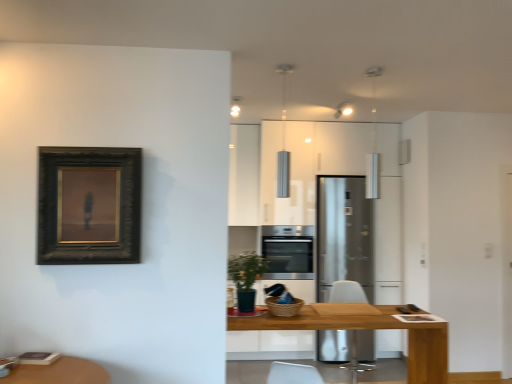
Question: Does satin silver refrigerator at center turn towards white plastic swivel chair at center?

Choices:
 (A) yes
 (B) no

Answer: (A)

Question: Does satin silver refrigerator at center have a greater height compared to white plastic swivel chair at center?

Choices:
 (A) no
 (B) yes

Answer: (B)

Question: Can you confirm if satin silver refrigerator at center is smaller than white plastic swivel chair at center?

Choices:
 (A) no
 (B) yes

Answer: (A)

Question: Is satin silver refrigerator at center not within white plastic swivel chair at center?

Choices:
 (A) no
 (B) yes

Answer: (B)

Question: Is the position of satin silver refrigerator at center less distant than that of white plastic swivel chair at center?

Choices:
 (A) yes
 (B) no

Answer: (B)

Question: Considering their positions, is white plastic swivel chair at center located in front of or behind wooden table at center?

Choices:
 (A) front
 (B) behind

Answer: (B)

Question: In the image, is white plastic swivel chair at center on the left side or the right side of wooden table at center?

Choices:
 (A) right
 (B) left

Answer: (A)

Question: From the image's perspective, is white plastic swivel chair at center located above or below wooden table at center?

Choices:
 (A) above
 (B) below

Answer: (B)

Question: Is white plastic swivel chair at center spatially inside wooden table at center, or outside of it?

Choices:
 (A) outside
 (B) inside

Answer: (A)

Question: Relative to dark wood frame at upper left, is satin silver refrigerator at center in front or behind?

Choices:
 (A) behind
 (B) front

Answer: (A)

Question: From a real-world perspective, is satin silver refrigerator at center positioned above or below dark wood frame at upper left?

Choices:
 (A) below
 (B) above

Answer: (A)

Question: Considering the positions of point (322, 246) and point (87, 203), is point (322, 246) closer or farther from the camera than point (87, 203)?

Choices:
 (A) farther
 (B) closer

Answer: (A)

Question: Is satin silver refrigerator at center situated inside dark wood frame at upper left or outside?

Choices:
 (A) inside
 (B) outside

Answer: (B)

Question: From the image's perspective, relative to wooden table at center, is dark wood frame at upper left above or below?

Choices:
 (A) above
 (B) below

Answer: (A)

Question: From a real-world perspective, relative to wooden table at center, is dark wood frame at upper left vertically above or below?

Choices:
 (A) above
 (B) below

Answer: (A)